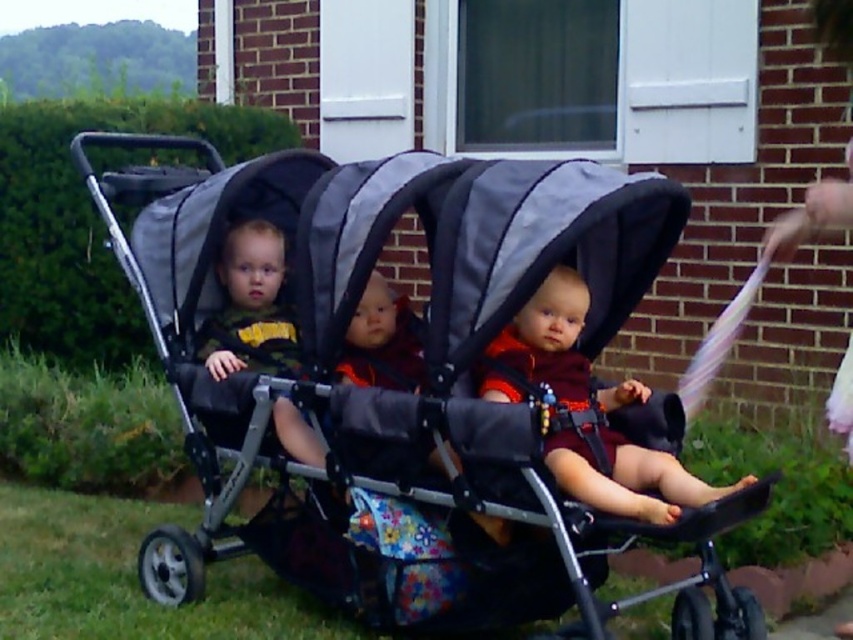
Question: Which point is farther from the camera taking this photo?

Choices:
 (A) (541, 380)
 (B) (424, 342)

Answer: (B)

Question: Does gray fabric stroller at center appear under matte black stroller at center?

Choices:
 (A) yes
 (B) no

Answer: (B)

Question: Is gray fabric stroller at center positioned at the back of matte black stroller at center?

Choices:
 (A) no
 (B) yes

Answer: (A)

Question: Where is gray fabric stroller at center located in relation to matte black stroller at center in the image?

Choices:
 (A) left
 (B) right

Answer: (A)